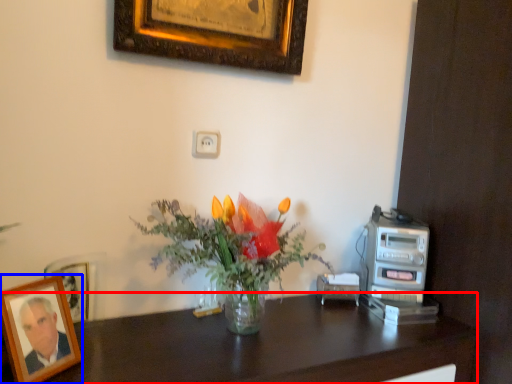
Question: Which object is further to the camera taking this photo, desk (highlighted by a red box) or picture frame (highlighted by a blue box)?

Choices:
 (A) desk
 (B) picture frame

Answer: (B)